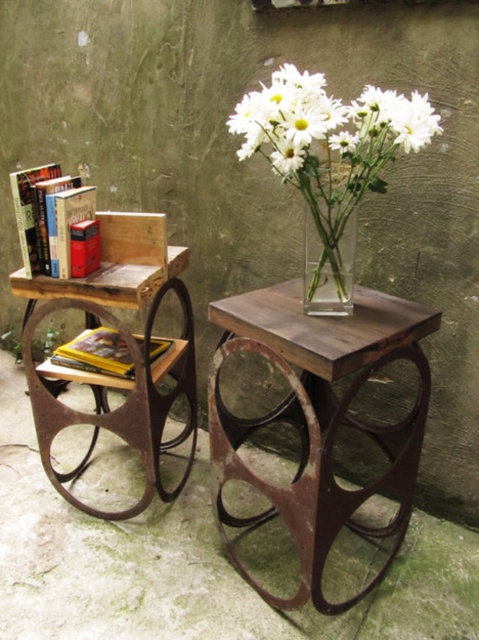
Is white matte vase at upper center shorter than clear glass vase at center?

No, white matte vase at upper center is not shorter than clear glass vase at center.

Between point (358, 157) and point (349, 218), which one is positioned in front?

Point (358, 157) is more forward.

Is point (262, 115) closer to viewer compared to point (316, 268)?

Yes, point (262, 115) is in front of point (316, 268).

Where is `white matte vase at upper center`? white matte vase at upper center is located at coordinates (330, 125).

Does wooden table at center appear over white matte vase at upper center?

Incorrect, wooden table at center is not positioned above white matte vase at upper center.

Does wooden table at center appear on the left side of white matte vase at upper center?

No, wooden table at center is not to the left of white matte vase at upper center.

Where is `wooden table at center`? wooden table at center is located at coordinates (319, 419).

At what (x,y) coordinates should I click in order to perform the action: click on wooden table at center. Please return your answer as a coordinate pair (x, y). This screenshot has height=640, width=479. Looking at the image, I should click on (319, 419).

Can you confirm if wooden table at left is wider than white matte vase at upper center?

In fact, wooden table at left might be narrower than white matte vase at upper center.

Is wooden table at left above white matte vase at upper center?

No, wooden table at left is not above white matte vase at upper center.

Is point (162, 416) closer to viewer compared to point (291, 140)?

That is False.

Identify the location of wooden table at left. This screenshot has width=479, height=640. (128, 394).